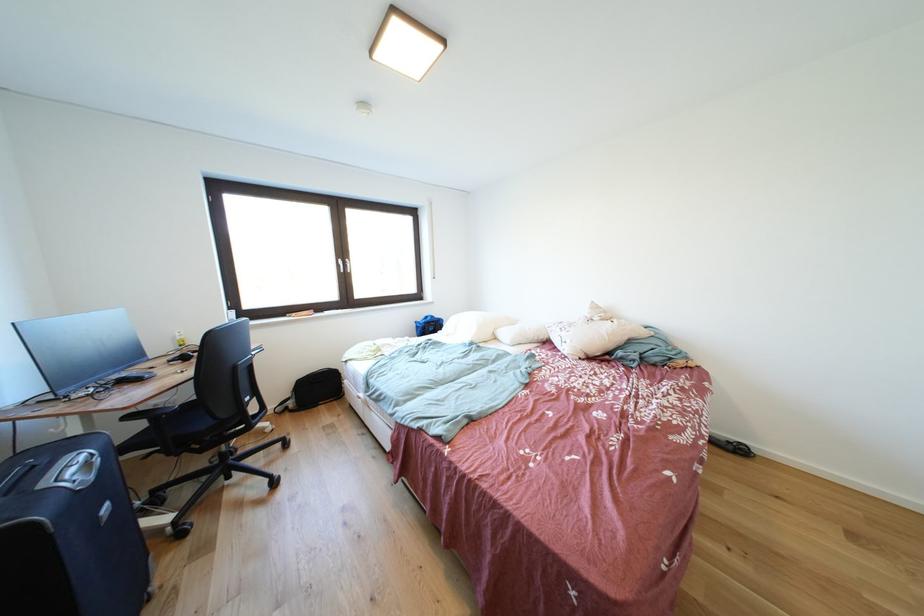
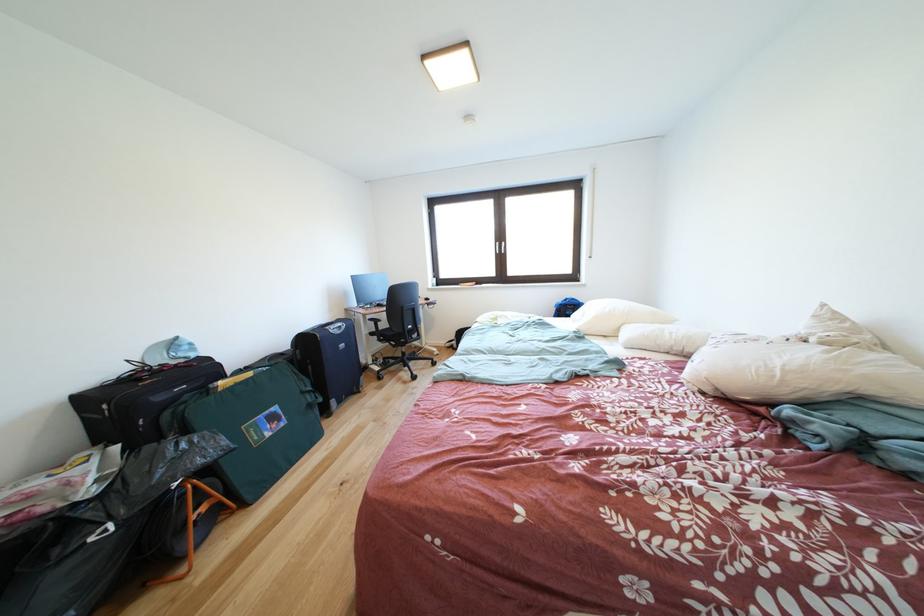
The point at (101,483) is marked in the first image. Where is the corresponding point in the second image?

(347, 337)